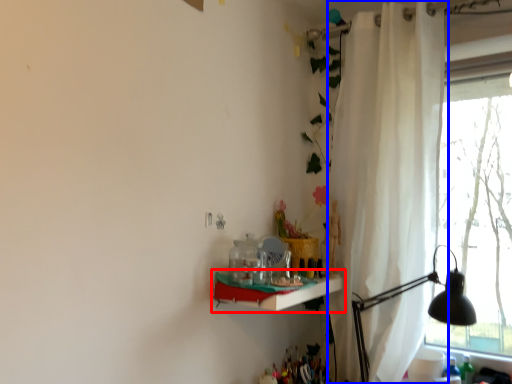
Question: Which point is further to the camera, shelf (highlighted by a red box) or curtain (highlighted by a blue box)?

Choices:
 (A) shelf
 (B) curtain

Answer: (B)